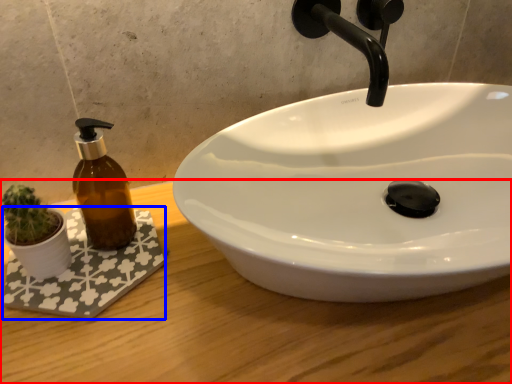
Question: Which object is further to the camera taking this photo, counter top (highlighted by a red box) or bath mat (highlighted by a blue box)?

Choices:
 (A) counter top
 (B) bath mat

Answer: (B)